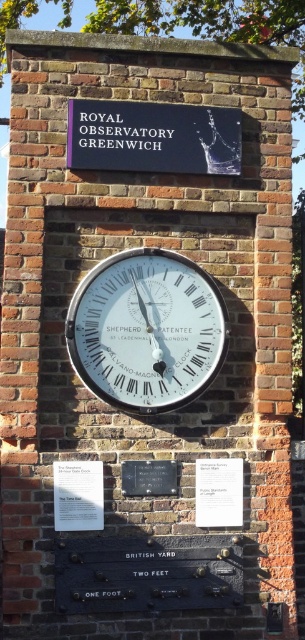
Question: Which object is positioned closest to the blue plastic sign at upper center?

Choices:
 (A) black stone plaque at center
 (B) white paper plaque at center

Answer: (A)

Question: Which point is closer to the camera?

Choices:
 (A) (124, 276)
 (B) (194, 515)

Answer: (B)

Question: Considering the real-world distances, which object is closest to the blue plastic sign at upper center?

Choices:
 (A) black stone plaque at center
 (B) white paper plaque at center
 (C) white glossy clock at center
 (D) white paper at center

Answer: (C)

Question: Is blue plastic sign at upper center positioned before white paper at center?

Choices:
 (A) yes
 (B) no

Answer: (B)

Question: Can you confirm if white glossy clock at center is bigger than black stone plaque at center?

Choices:
 (A) no
 (B) yes

Answer: (B)

Question: Can you confirm if blue plastic sign at upper center is positioned to the left of black stone plaque at center?

Choices:
 (A) no
 (B) yes

Answer: (A)